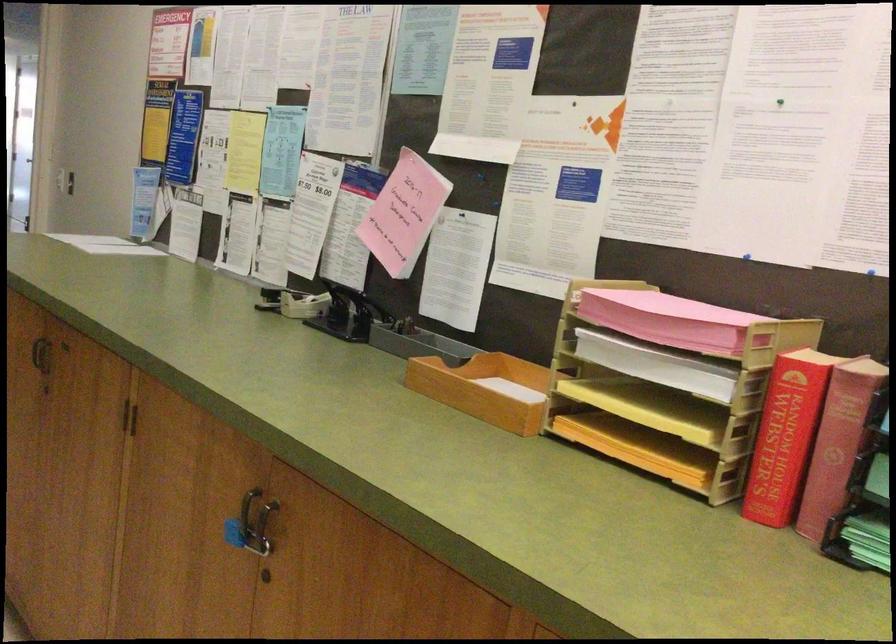
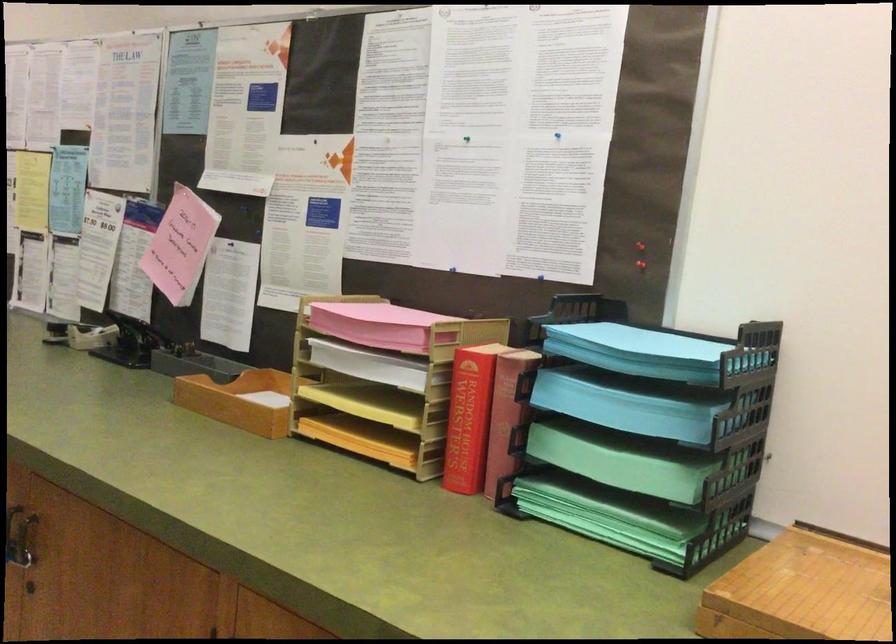
Question: How did the camera likely rotate?

Choices:
 (A) Left
 (B) Right
 (C) Up
 (D) Down

Answer: (B)